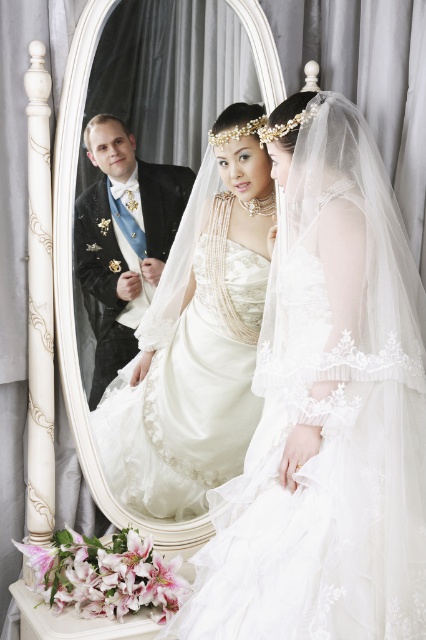
Question: Which is farther from the satin dress at center?

Choices:
 (A) black satin tuxedo at left
 (B) white lace dress at center

Answer: (B)

Question: Which point is closer to the camera taking this photo?

Choices:
 (A) (95, 387)
 (B) (235, 132)
 (C) (189, 608)

Answer: (C)

Question: Is satin dress at center thinner than black satin tuxedo at left?

Choices:
 (A) no
 (B) yes

Answer: (A)

Question: Does white lace dress at center appear on the right side of satin dress at center?

Choices:
 (A) no
 (B) yes

Answer: (B)

Question: Is white lace dress at center above black satin tuxedo at left?

Choices:
 (A) no
 (B) yes

Answer: (A)

Question: Which of the following is the closest to the observer?

Choices:
 (A) satin dress at center
 (B) white lace dress at center

Answer: (B)